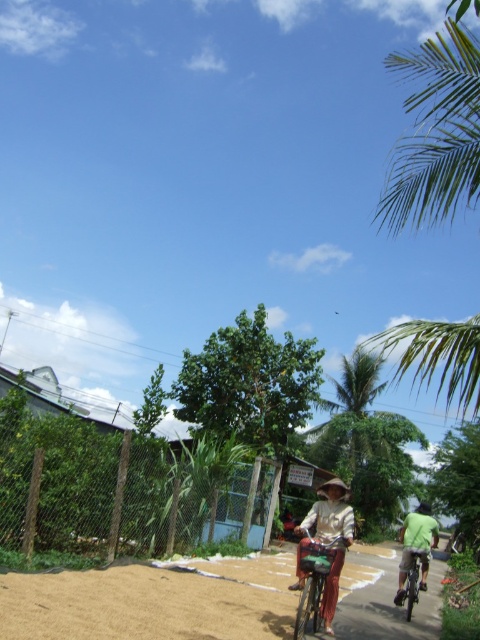
Can you confirm if brown sandy ground at lower left is thinner than green leafy palm tree at upper right?

Correct, brown sandy ground at lower left's width is less than green leafy palm tree at upper right's.

Measure the distance between point (384, 557) and camera.

They are 72.73 feet apart.

Is point (23, 636) positioned before point (454, 44)?

Yes, point (23, 636) is closer to viewer.

I want to click on brown sandy ground at lower left, so click(153, 602).

Does brown sandy ground at lower left have a lesser height compared to metallic silver bicycle at center?

No.

How much distance is there between brown sandy ground at lower left and metallic silver bicycle at center?

brown sandy ground at lower left is 4.93 feet away from metallic silver bicycle at center.

Does point (7, 596) come behind point (299, 560)?

No, it is not.

Find the location of `brown sandy ground at lower left`. brown sandy ground at lower left is located at coordinates (153, 602).

Is metallic silver bicycle at center positioned in front of green fabric shirt at right?

Yes, metallic silver bicycle at center is in front of green fabric shirt at right.

Who is more distant from viewer, (302, 554) or (416, 532)?

The point (416, 532) is more distant.

Where is `metallic silver bicycle at center`? This screenshot has height=640, width=480. metallic silver bicycle at center is located at coordinates (314, 579).